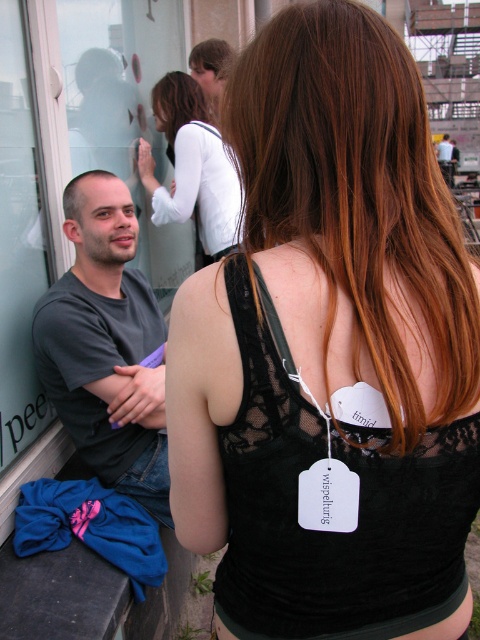
Question: Which of these objects is positioned closest to the matte black tank top at upper center?

Choices:
 (A) dark gray t-shirt at left
 (B) brown matte hair at left

Answer: (B)

Question: Is black lace tank top at center positioned behind brown matte hair at left?

Choices:
 (A) no
 (B) yes

Answer: (A)

Question: Based on their relative distances, which object is nearer to the white fabric strap at upper center?

Choices:
 (A) brown matte hair at left
 (B) black lace tank top at center
 (C) matte black tank top at upper center
 (D) brown smooth hair at upper center

Answer: (D)

Question: Does dark gray t-shirt at left have a lesser width compared to brown smooth hair at upper center?

Choices:
 (A) yes
 (B) no

Answer: (B)

Question: Which object is closer to the camera taking this photo?

Choices:
 (A) matte black tank top at upper center
 (B) white fabric strap at upper center

Answer: (B)

Question: Is white lace blouse at upper center to the left of matte black tank top at upper center from the viewer's perspective?

Choices:
 (A) yes
 (B) no

Answer: (A)